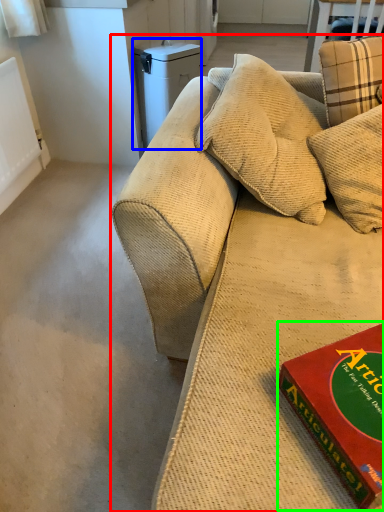
Question: Which object is positioned closest to studio couch (highlighted by a red box)? Select from appliance (highlighted by a blue box) and paperback book (highlighted by a green box).

Choices:
 (A) appliance
 (B) paperback book

Answer: (B)